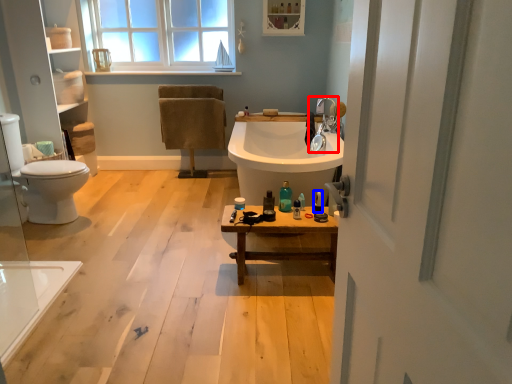
Question: Which object appears closest to the camera in this image, tap (highlighted by a red box) or toiletry (highlighted by a blue box)?

Choices:
 (A) tap
 (B) toiletry

Answer: (B)